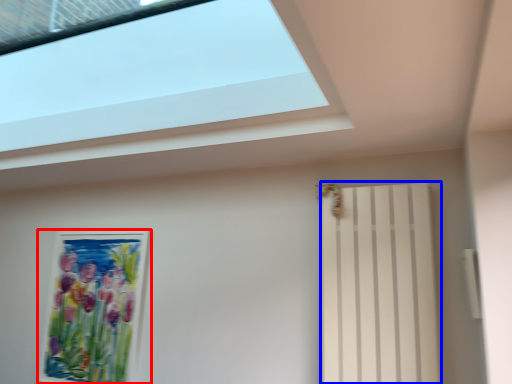
Question: Which point is further to the camera, picture frame (highlighted by a red box) or shutter (highlighted by a blue box)?

Choices:
 (A) picture frame
 (B) shutter

Answer: (A)